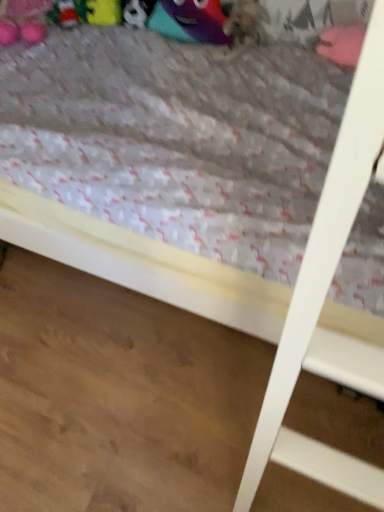
The width and height of the screenshot is (384, 512). Describe the element at coordinates (103, 12) in the screenshot. I see `plush yellow bear at upper left` at that location.

The image size is (384, 512). What are the coordinates of `plush yellow bear at upper left` in the screenshot? It's located at (103, 12).

In order to face plush yellow bear at upper left, should I rotate leftwards or rightwards?

It's best to rotate left around 11.763 degrees.

This screenshot has width=384, height=512. I want to click on plush yellow bear at upper left, so click(103, 12).